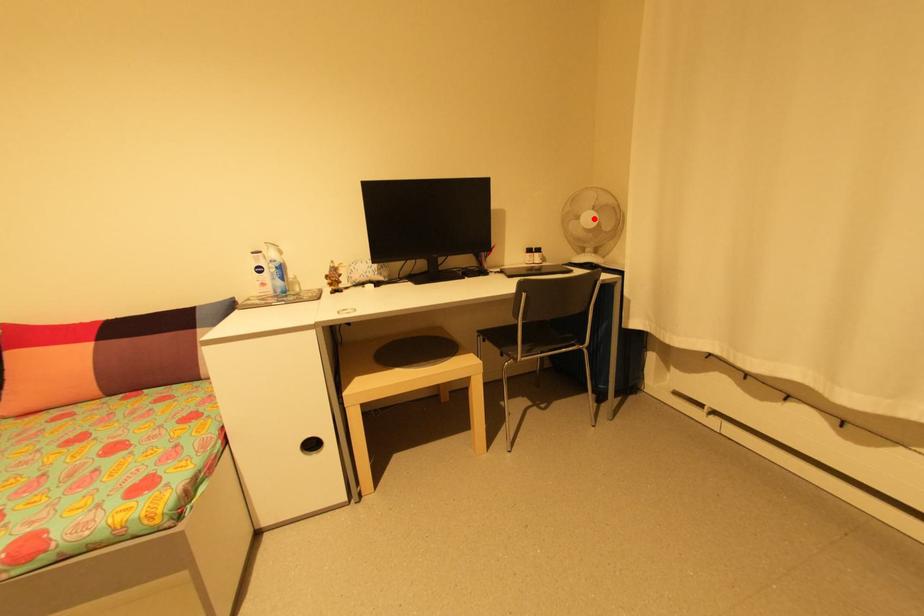
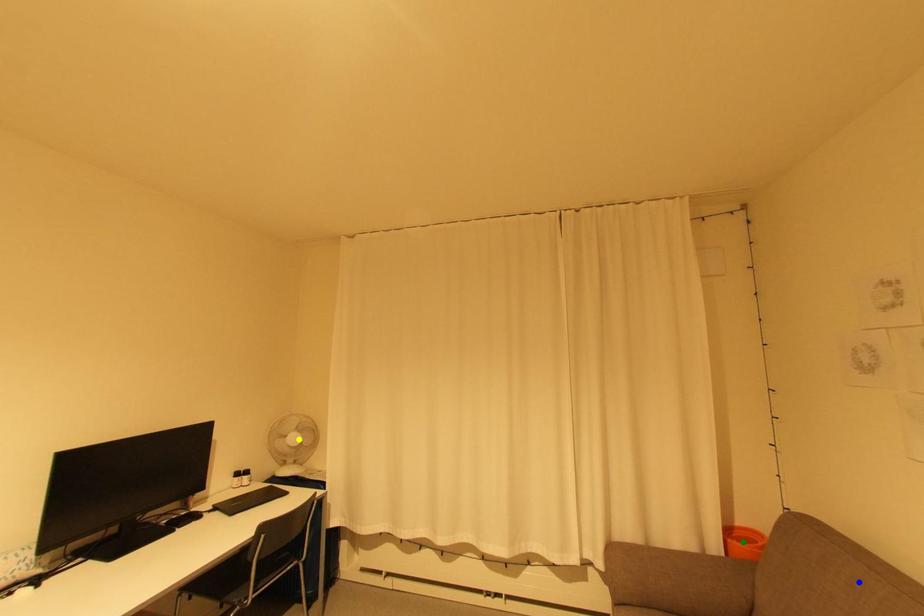
Question: I am providing you with two images of the same scene from different viewpoints. A red point is marked on the first image. You are given multiple points on the second image. Which point in image 2 is actually the same real-world point as the red point in image 1?

Choices:
 (A) blue point
 (B) green point
 (C) yellow point

Answer: (C)